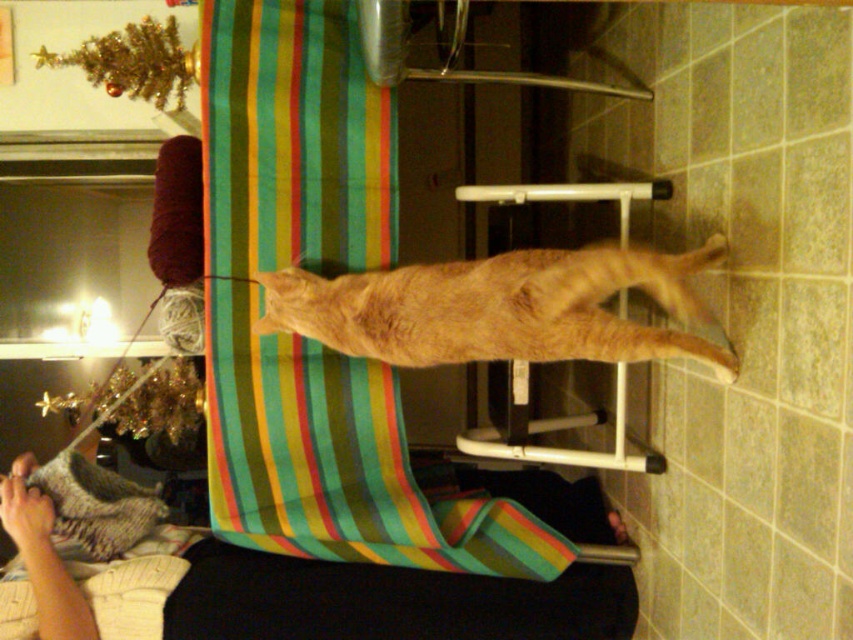
You are a drone trying to deliver a small package to the multicolored striped fabric at center. Based on the scene description, what are the coordinates where you should drop the package?

The coordinates for the multicolored striped fabric at center are at point (337, 461), so you should drop the package there.

You are a photographer trying to capture the ginger cat on the striped blanket. The multicolored striped fabric at center is marked by point (x=337, y=461). Where should you position your camera to ensure the ginger cat is centered in the photo?

The multicolored striped fabric at center is represented by point (x=337, y=461), so you should position your camera directly above this point to center the ginger cat in the photo.